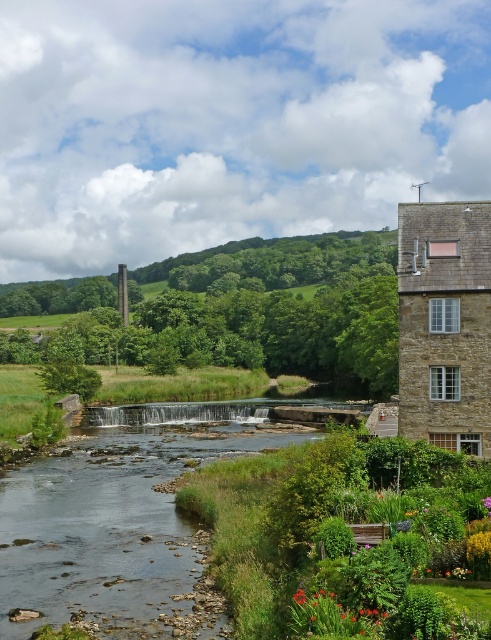
You are standing at the point labeled as point (332, 538) in the image. What do you see around you?

You are standing in the green leafy garden at lower right, which is located near the stone building on the right side of the image.

You are a gardener who wants to water the green leafy garden at lower right using a hose connected to the clear water at center. The hose can extend up to 8 meters. Will the hose reach the garden from the water source?

The distance between the green leafy garden at lower right and the clear water at center is 8.15 meters, which is longer than the hose can extend. Therefore, the hose will not reach the garden from the water source.